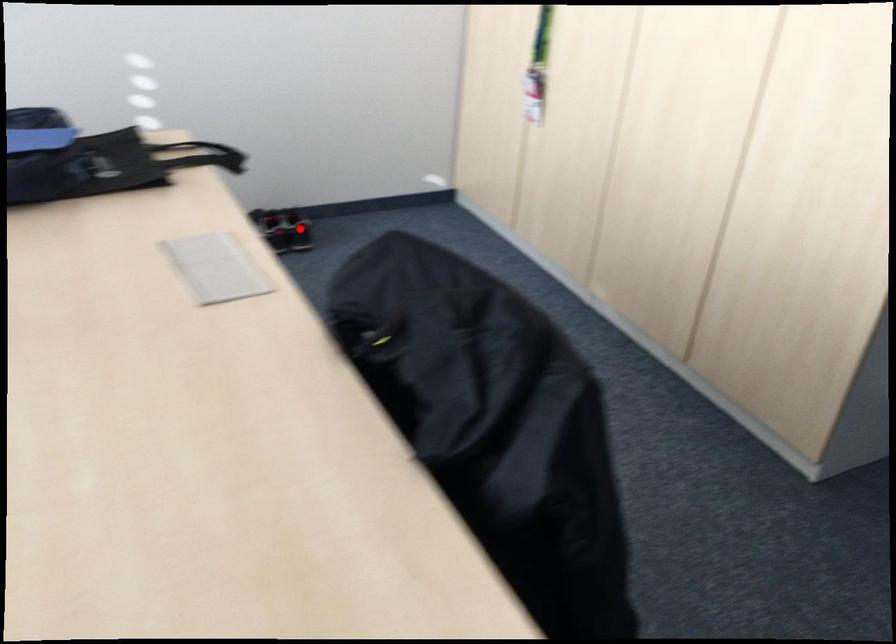
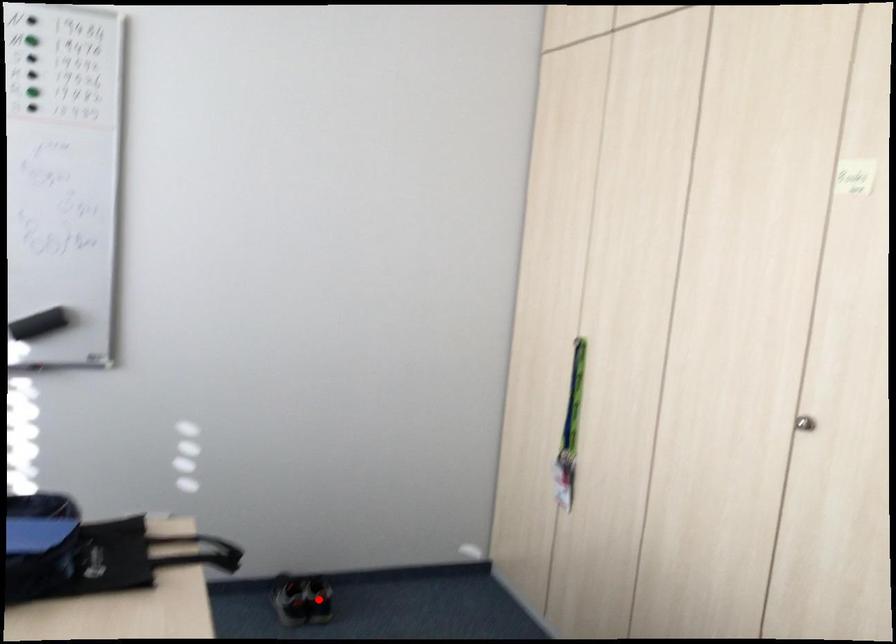
I am providing you with two images of the same scene from different viewpoints. A red point is marked on the first image and another point is marked on the second image. Are the points marked in image1 and image2 representing the same 3D position?

Yes